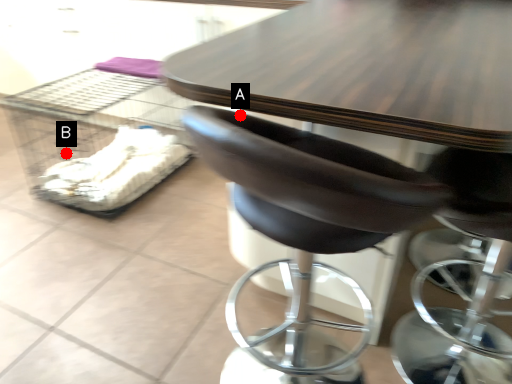
Question: Two points are circled on the image, labeled by A and B beside each circle. Which point is further to the camera?

Choices:
 (A) A is further
 (B) B is further

Answer: (B)